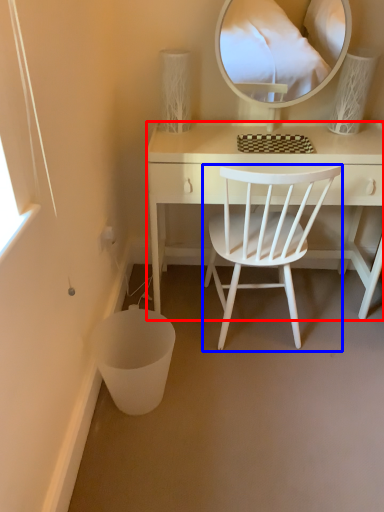
Question: Which object appears closest to the camera in this image, desk (highlighted by a red box) or chair (highlighted by a blue box)?

Choices:
 (A) desk
 (B) chair

Answer: (B)